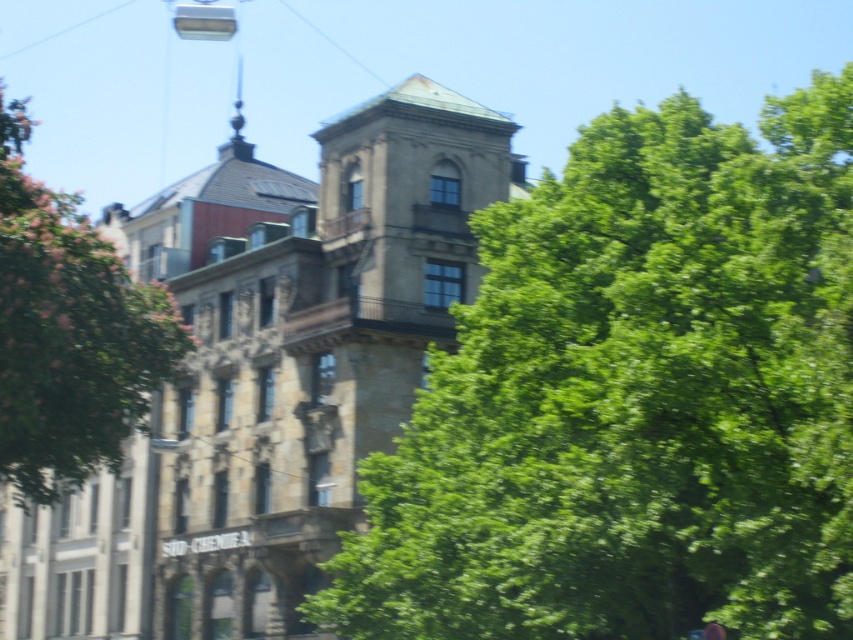
You are standing in front of the historic building and notice the stone textured bell tower at center and the green leafy tree at left. Which object is positioned lower in the scene?

The stone textured bell tower at center is positioned lower than the green leafy tree at left.

You are standing in front of the historic building and notice both the green leafy tree at center and the stone textured bell tower at center. Which object is positioned lower in the scene?

The green leafy tree at center is located below the stone textured bell tower at center, so it is positioned lower in the scene.

You are standing in front of the historic building and notice two green leafy trees. Which tree, the green leafy tree at center or the green leafy tree at left, is taller?

The green leafy tree at left is taller than the green leafy tree at center.